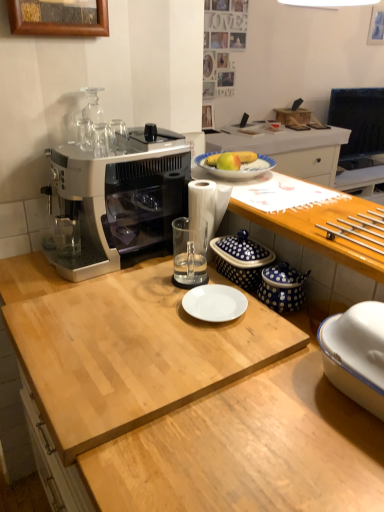
Locate an element on the screen. vacant area on top of light wood cutting board at center, which is counted as the first desk, starting from the bottom (from a real-world perspective) is located at coordinates (143, 323).